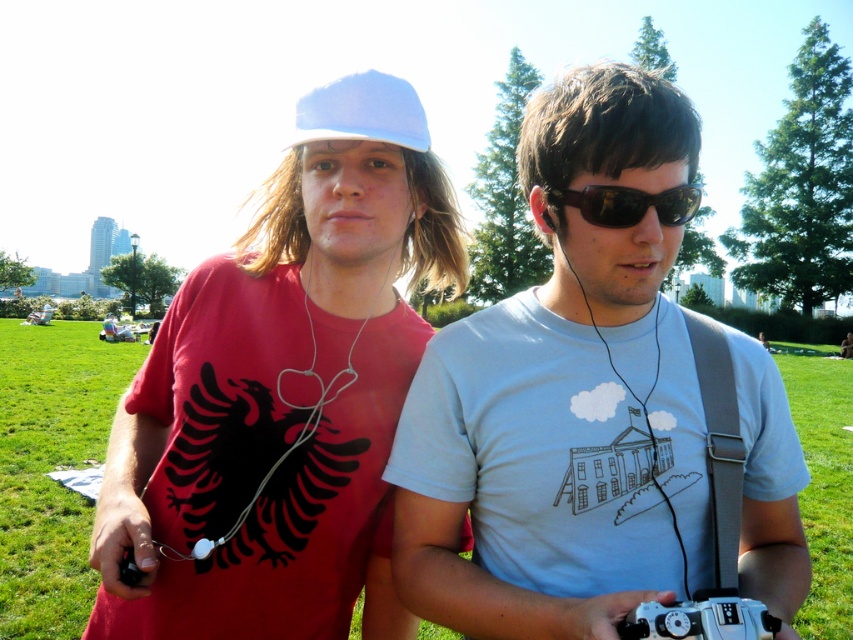
You are a photographer trying to capture a candid shot of the two people in the park. You notice the light blue fabric baseball cap at upper center and the sunglasses at center. Which object should you adjust your focus to first if you want to capture both items clearly in the same frame?

The light blue fabric baseball cap at upper center is located above the sunglasses at center, so you should focus on the sunglasses at center first to ensure both items are in the frame.

You are trying to decide which item to grab first from the scene. The light blue fabric baseball cap at upper center and the sunglasses at center are both within reach. Which one is taller?

The light blue fabric baseball cap at upper center is taller than the sunglasses at center, so you should grab the light blue fabric baseball cap at upper center first if you need the taller item.